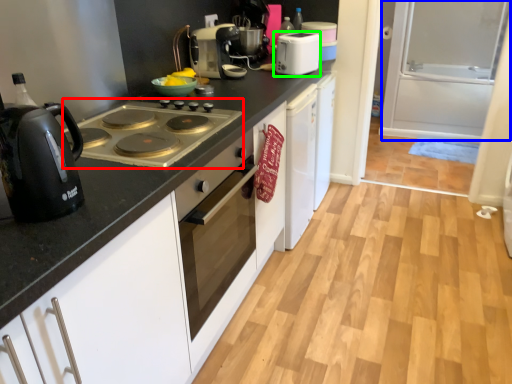
Question: Which object is the closest to the gas stove (highlighted by a red box)? Choose among these: screen door (highlighted by a blue box) or kitchen appliance (highlighted by a green box).

Choices:
 (A) screen door
 (B) kitchen appliance

Answer: (B)